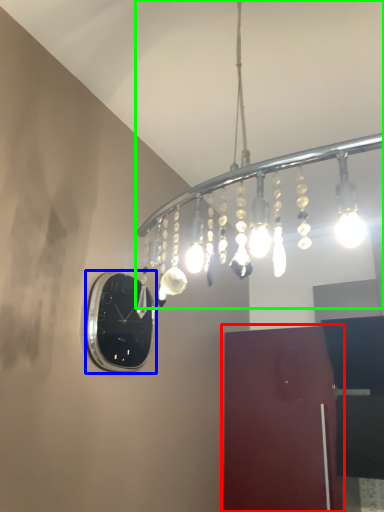
Question: Which object is positioned closest to door (highlighted by a red box)? Select from clock (highlighted by a blue box) and lamp (highlighted by a green box).

Choices:
 (A) clock
 (B) lamp

Answer: (B)